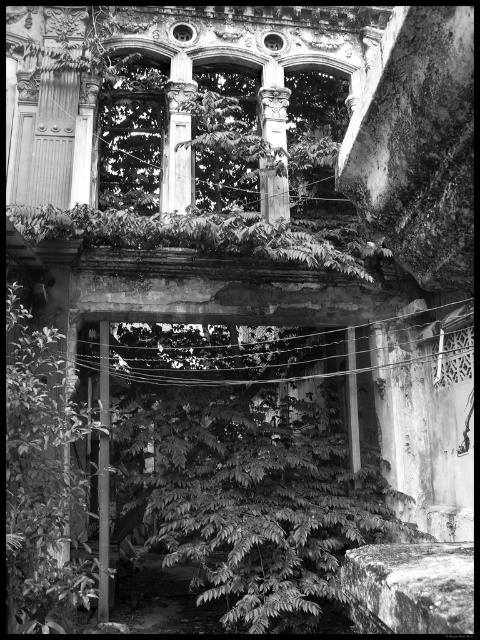
Question: Is green leafy tree at center bigger than smooth stone column at center?

Choices:
 (A) yes
 (B) no

Answer: (A)

Question: Does green leafy tree at center have a greater width compared to smooth stone column at center?

Choices:
 (A) yes
 (B) no

Answer: (A)

Question: Which point is closer to the camera taking this photo?

Choices:
 (A) (180, 141)
 (B) (76, 588)
 (C) (261, 198)

Answer: (B)

Question: Which of these objects is positioned closest to the smooth stone column at center?

Choices:
 (A) smooth white column at center
 (B) green leafy tree at center

Answer: (A)

Question: Does green leafy tree at center appear over smooth white column at center?

Choices:
 (A) yes
 (B) no

Answer: (B)

Question: Among these objects, which one is farthest from the camera?

Choices:
 (A) green leafy tree at center
 (B) smooth white column at center

Answer: (B)